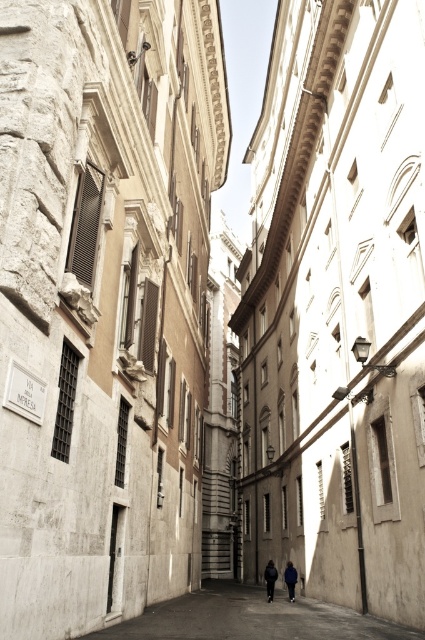
Question: Can you confirm if concrete alley at center is positioned to the left of dark blue jacket at center?

Choices:
 (A) yes
 (B) no

Answer: (A)

Question: Does dark blue jacket at center lie behind blue fabric jacket at center?

Choices:
 (A) yes
 (B) no

Answer: (A)

Question: Which object is farther from the camera taking this photo?

Choices:
 (A) blue fabric jacket at center
 (B) concrete alley at center
 (C) dark blue jacket at center

Answer: (C)

Question: Which point is farther to the camera?

Choices:
 (A) (289, 576)
 (B) (272, 580)

Answer: (B)

Question: Is concrete alley at center to the left of dark blue jacket at center from the viewer's perspective?

Choices:
 (A) no
 (B) yes

Answer: (B)

Question: Among these points, which one is nearest to the camera?

Choices:
 (A) (243, 637)
 (B) (291, 566)

Answer: (A)